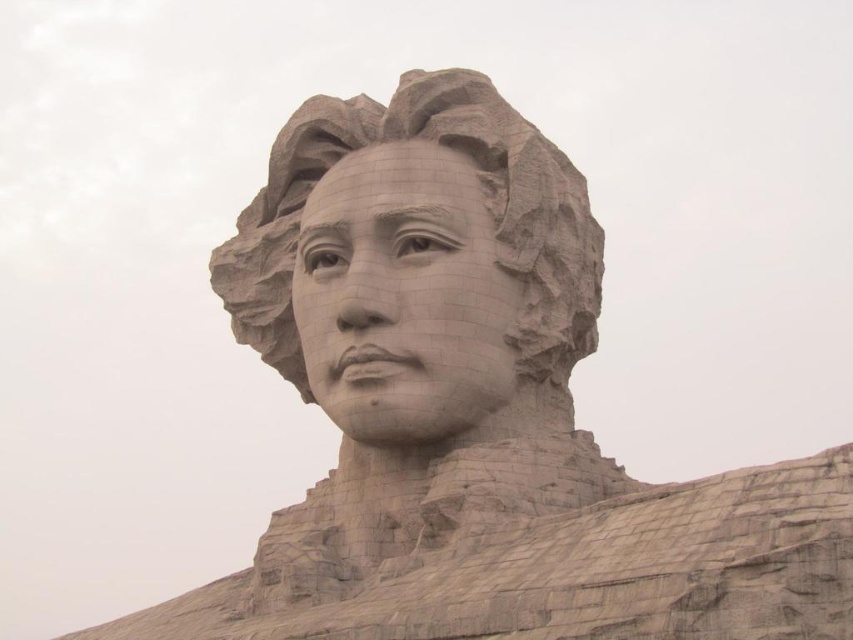
Question: Is matte stone face at center to the right of gray stone sculpture at center from the viewer's perspective?

Choices:
 (A) no
 (B) yes

Answer: (A)

Question: Which point is closer to the camera taking this photo?

Choices:
 (A) (396, 227)
 (B) (558, 324)

Answer: (A)

Question: Which point is closer to the camera?

Choices:
 (A) (397, 134)
 (B) (296, 304)

Answer: (A)

Question: Does matte stone face at center have a lesser width compared to gray stone sculpture at center?

Choices:
 (A) yes
 (B) no

Answer: (A)

Question: Which object is closer to the camera taking this photo?

Choices:
 (A) matte stone face at center
 (B) gray stone sculpture at center

Answer: (A)

Question: Is matte stone face at center bigger than gray stone sculpture at center?

Choices:
 (A) yes
 (B) no

Answer: (B)